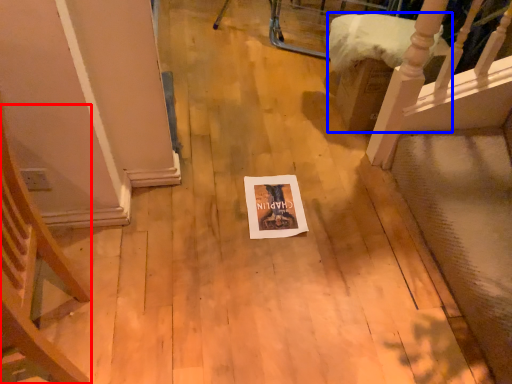
Question: Which of the following is the farthest to the observer, armchair (highlighted by a red box) or furniture (highlighted by a blue box)?

Choices:
 (A) armchair
 (B) furniture

Answer: (B)